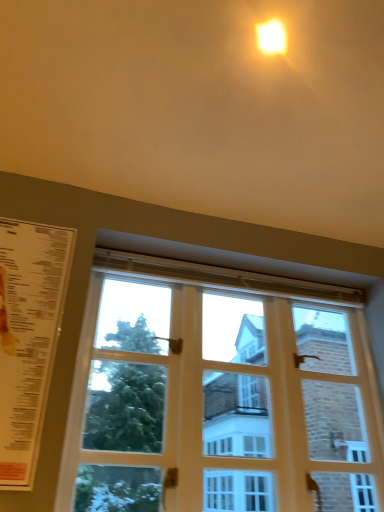
Question: Would you say white paper menu at left is inside or outside matte yellow light at upper center?

Choices:
 (A) outside
 (B) inside

Answer: (A)

Question: From a real-world perspective, is white paper menu at left positioned above or below matte yellow light at upper center?

Choices:
 (A) below
 (B) above

Answer: (A)

Question: Which object is positioned farthest from the white paper menu at left?

Choices:
 (A) matte yellow light at upper center
 (B) white wooden window at center

Answer: (A)

Question: Estimate the real-world distances between objects in this image. Which object is closer to the white paper menu at left?

Choices:
 (A) matte yellow light at upper center
 (B) white wooden window at center

Answer: (B)